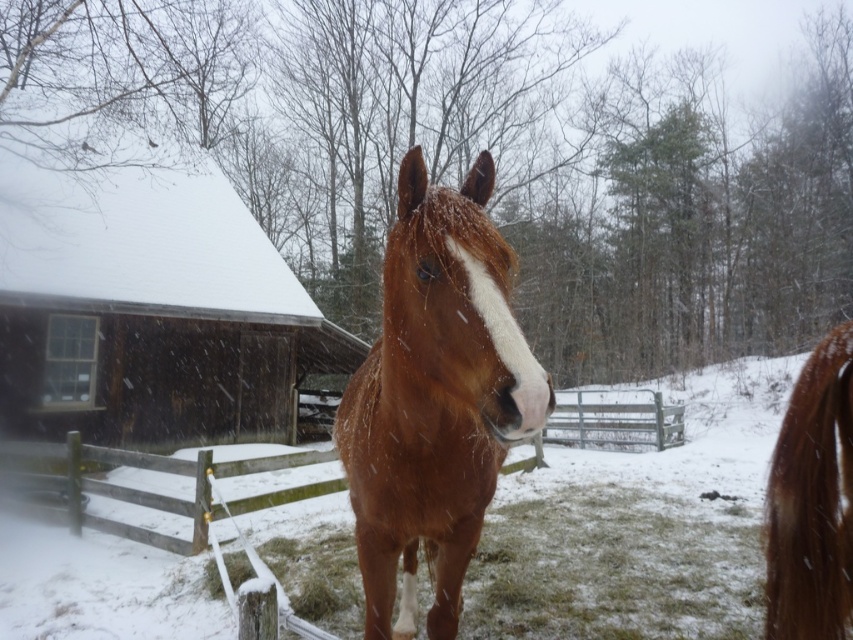
Can you confirm if brown glossy horse at right is positioned above wooden at center?

Yes.

Which is more to the right, brown glossy horse at right or wooden at center?

wooden at center is more to the right.

Between point (807, 632) and point (135, 460), which one is positioned behind?

Point (135, 460)

What are the coordinates of `brown glossy horse at right` in the screenshot? It's located at (811, 500).

Is green grass at center wider than wooden at center?

Incorrect, green grass at center's width does not surpass wooden at center's.

Is point (722, 550) in front of point (578, 392)?

Yes, it is.

This screenshot has width=853, height=640. What do you see at coordinates (614, 568) in the screenshot?
I see `green grass at center` at bounding box center [614, 568].

Find the location of a particular element. The width and height of the screenshot is (853, 640). green grass at center is located at coordinates (614, 568).

Does dark brown wooden barn at left have a larger size compared to wooden at center?

Actually, dark brown wooden barn at left might be smaller than wooden at center.

Between dark brown wooden barn at left and wooden at center, which one appears on the left side from the viewer's perspective?

Positioned to the left is dark brown wooden barn at left.

The height and width of the screenshot is (640, 853). Find the location of `dark brown wooden barn at left`. dark brown wooden barn at left is located at coordinates (149, 314).